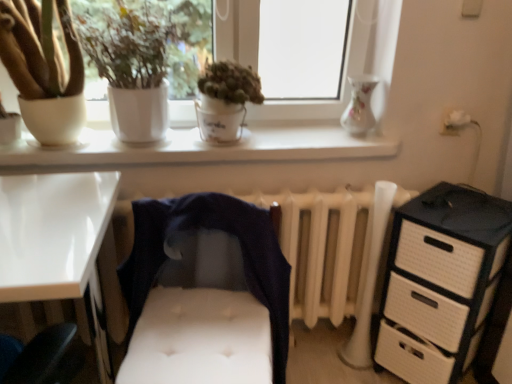
What are the coordinates of `vacant region above white glossy desk at lower left (from a real-world perspective)` in the screenshot? It's located at (46, 211).